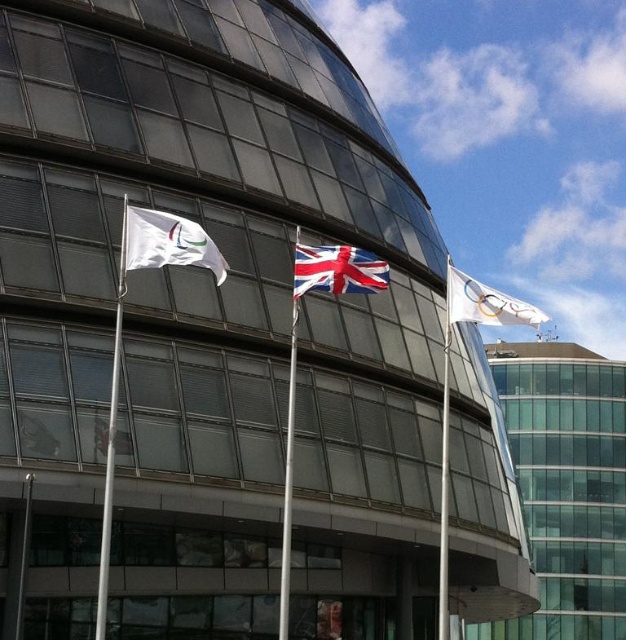
Is white metallic flag pole at center taller than white fabric flagpole at center?

In fact, white metallic flag pole at center may be shorter than white fabric flagpole at center.

Is point (295, 227) positioned after point (439, 632)?

That is False.

Locate an element on the screen. This screenshot has width=626, height=640. white metallic flag pole at center is located at coordinates (289, 477).

Is white plastic flag pole at left above white glossy flag at upper right?

Incorrect, white plastic flag pole at left is not positioned above white glossy flag at upper right.

Is white plastic flag pole at left to the left of white glossy flag at upper right from the viewer's perspective?

Yes, white plastic flag pole at left is to the left of white glossy flag at upper right.

Does point (110, 476) lie behind point (511, 321)?

That is False.

You are a GUI agent. You are given a task and a screenshot of the screen. Output one action in this format:
    pyautogui.click(x=<x>, y=<y>)
    Task: Click on the white plastic flag pole at left
    Image resolution: width=626 pixels, height=640 pixels.
    Given the screenshot: What is the action you would take?
    pyautogui.click(x=110, y=470)

This screenshot has height=640, width=626. I want to click on red fabric flag at center, so click(337, 269).

Can you confirm if red fabric flag at center is positioned to the right of white metallic flag pole at center?

Yes, red fabric flag at center is to the right of white metallic flag pole at center.

The image size is (626, 640). What do you see at coordinates (337, 269) in the screenshot?
I see `red fabric flag at center` at bounding box center [337, 269].

Locate an element on the screen. red fabric flag at center is located at coordinates (337, 269).